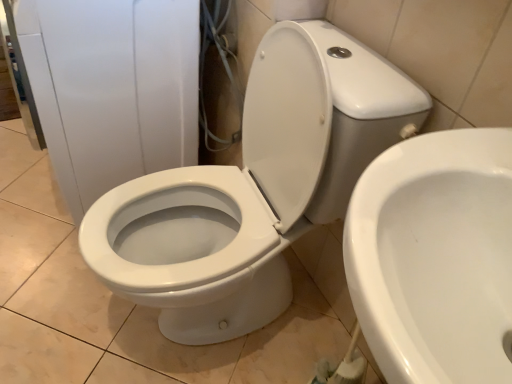
Question: Can you confirm if white glossy toilet at center, which is the 2th toilet from right to left, is thinner than white glossy toilet at center, the first toilet viewed from the right?

Choices:
 (A) no
 (B) yes

Answer: (A)

Question: Is white glossy toilet at center, which is the 2th toilet from right to left, wider than white glossy toilet at center, the first toilet viewed from the right?

Choices:
 (A) no
 (B) yes

Answer: (B)

Question: From the image's perspective, is white glossy toilet at center, arranged as the first toilet when viewed from the left, located beneath white glossy toilet at center, the first toilet viewed from the right?

Choices:
 (A) yes
 (B) no

Answer: (B)

Question: Is white glossy toilet at center, which is the 2th toilet from right to left, completely or partially outside of white glossy toilet at center, which ranks as the second toilet in left-to-right order?

Choices:
 (A) yes
 (B) no

Answer: (A)

Question: From a real-world perspective, is white glossy toilet at center, which is the 2th toilet from right to left, beneath white glossy toilet at center, the first toilet viewed from the right?

Choices:
 (A) no
 (B) yes

Answer: (B)

Question: Could you tell me if white glossy toilet at center, which is the 2th toilet from right to left, is facing white glossy toilet at center, which ranks as the second toilet in left-to-right order?

Choices:
 (A) yes
 (B) no

Answer: (B)

Question: From a real-world perspective, is white glossy toilet at center, arranged as the first toilet when viewed from the left, located beneath white glossy toilet at center?

Choices:
 (A) no
 (B) yes

Answer: (A)

Question: From a real-world perspective, is white glossy toilet at center, which is the 2th toilet from right to left, positioned over white glossy toilet at center based on gravity?

Choices:
 (A) yes
 (B) no

Answer: (A)

Question: Is white glossy toilet at center, arranged as the first toilet when viewed from the left, at the left side of white glossy toilet at center?

Choices:
 (A) no
 (B) yes

Answer: (A)

Question: Can you confirm if white glossy toilet at center, which is the 2th toilet from right to left, is positioned to the right of white glossy toilet at center?

Choices:
 (A) no
 (B) yes

Answer: (B)

Question: Is there a large distance between white glossy toilet at center, arranged as the first toilet when viewed from the left, and white glossy toilet at center?

Choices:
 (A) yes
 (B) no

Answer: (B)

Question: Can you confirm if white glossy toilet at center, arranged as the first toilet when viewed from the left, is bigger than white glossy toilet at center?

Choices:
 (A) no
 (B) yes

Answer: (A)

Question: Is white glossy toilet at center, the first toilet viewed from the right, closer to the viewer compared to white glossy toilet at center, which is the 2th toilet from right to left?

Choices:
 (A) no
 (B) yes

Answer: (B)